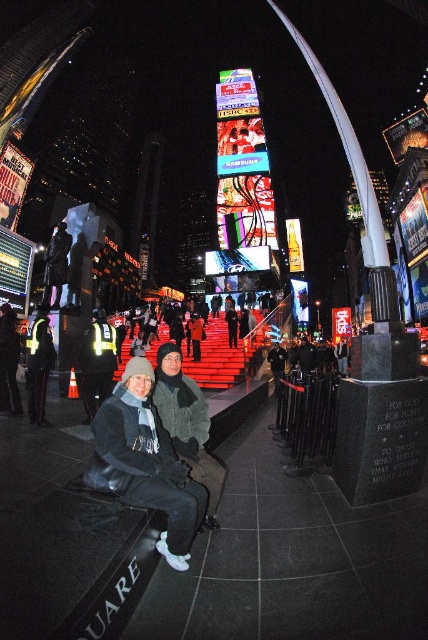
Does dark gray knit hat at lower center appear under reflective yellow vest at lower left?

Yes.

Which is more to the right, dark gray knit hat at lower center or reflective yellow vest at lower left?

dark gray knit hat at lower center is more to the right.

Who is more forward, (171, 536) or (95, 403)?

Point (171, 536)

At what (x,y) coordinates should I click in order to perform the action: click on dark gray knit hat at lower center. Please return your answer as a coordinate pair (x, y). This screenshot has height=640, width=428. Looking at the image, I should click on [145, 461].